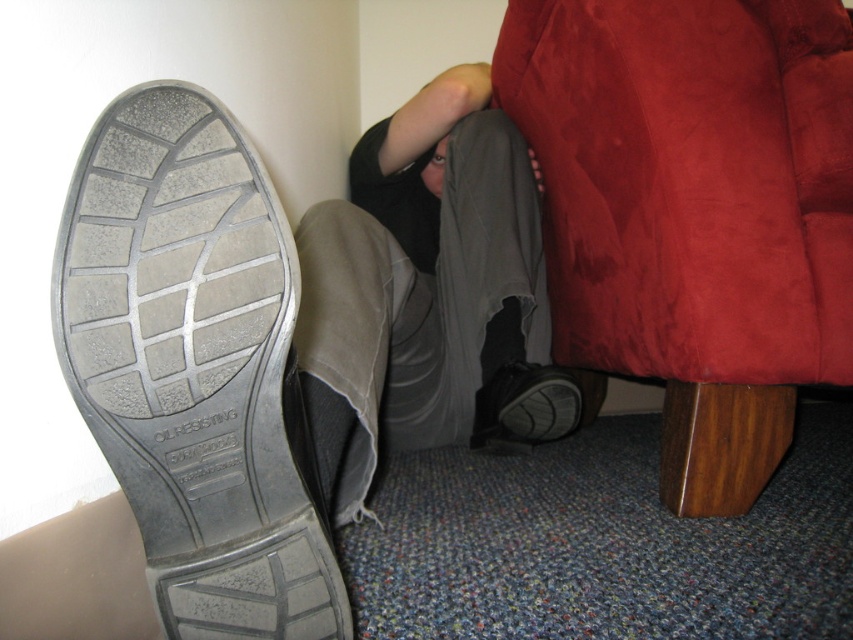
You are a photographer setting up a shoot. You need to position a camera so that the gray rubber shoe at lower left is in focus while ensuring the red couch is also visible but not the main focus. What adjustment should you make to the camera lens to achieve this?

To focus on the gray rubber shoe at lower left while keeping the red couch visible but not the main focus, adjust the camera lens to a shallow depth of field. This will blur the background, making the shoe the focal point while the couch remains in view but less prominent.

Based on the photo, you are a delivery person entering a living room and see the gray rubber shoe at lower left and the matte gray shoe at lower right. Which shoe is positioned closer to the left side of the room?

The gray rubber shoe at lower left is positioned closer to the left side of the room than the matte gray shoe at lower right.